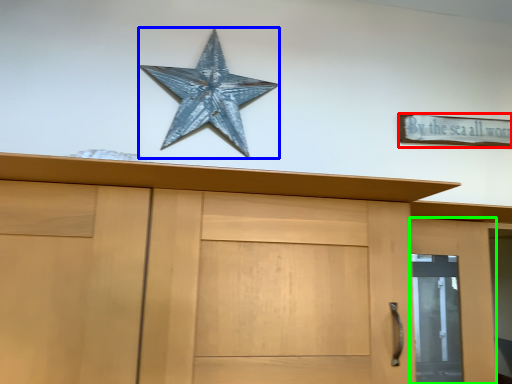
Question: Which object is the farthest from magnet (highlighted by a red box)? Choose among these: starfish (highlighted by a blue box) or door (highlighted by a green box).

Choices:
 (A) starfish
 (B) door

Answer: (A)